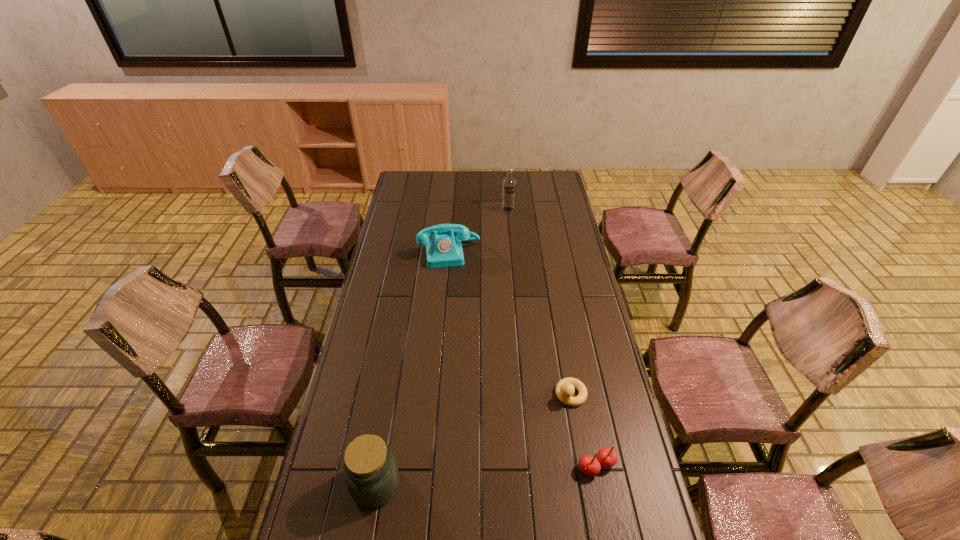
This screenshot has height=540, width=960. Find the location of `vacant region that satisfies the following two spatial constraints: 1. on the back side of the jar; 2. on the right side of the fourth nearest object`. vacant region that satisfies the following two spatial constraints: 1. on the back side of the jar; 2. on the right side of the fourth nearest object is located at coordinates (416, 253).

The width and height of the screenshot is (960, 540). What are the coordinates of `vacant space that satisfies the following two spatial constraints: 1. on the front side of the third object from left to right; 2. on the left side of the cherry` in the screenshot? It's located at (530, 466).

Where is `free spot that satisfies the following two spatial constraints: 1. on the back side of the fourth nearest object; 2. on the left side of the jar`? The image size is (960, 540). free spot that satisfies the following two spatial constraints: 1. on the back side of the fourth nearest object; 2. on the left side of the jar is located at coordinates (416, 253).

Find the location of a particular element. vacant space that satisfies the following two spatial constraints: 1. on the front side of the vodka; 2. on the right side of the duckling is located at coordinates (523, 394).